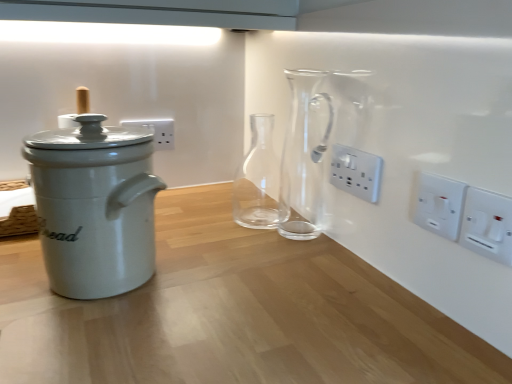
Question: Is transparent glass carafe at center, the first glass vase positioned from the front, inside the boundaries of white plastic electrical outlet at center-right, the 1th electric outlet in the back-to-front sequence, or outside?

Choices:
 (A) inside
 (B) outside

Answer: (B)

Question: Would you say transparent glass carafe at center, the first glass vase positioned from the front, is to the left or to the right of white plastic electrical outlet at center-right, the 1th electric outlet in the back-to-front sequence, in the picture?

Choices:
 (A) right
 (B) left

Answer: (B)

Question: Based on their relative distances, which object is farther from the brown woven basket at left?

Choices:
 (A) white plastic switch at right, the first electric outlet viewed from the front
 (B) white plastic switch at right, which is the 2th electric outlet in back-to-front order
 (C) white ceramic bread bin at left
 (D) white plastic electrical outlet at center-right, the 3th electric outlet viewed from the right
 (E) transparent glass carafe at center, the first glass vase positioned from the front

Answer: (A)

Question: Considering the real-world distances, which object is closest to the transparent glass carafe at center, the 2th glass vase in the back-to-front sequence?

Choices:
 (A) white ceramic bread bin at left
 (B) white plastic switch at right, which is the 2th electric outlet in back-to-front order
 (C) white plastic electrical outlet at center-right, the 3th electric outlet viewed from the right
 (D) white plastic switch at right, the 3th electric outlet from the left
 (E) brown woven basket at left

Answer: (C)